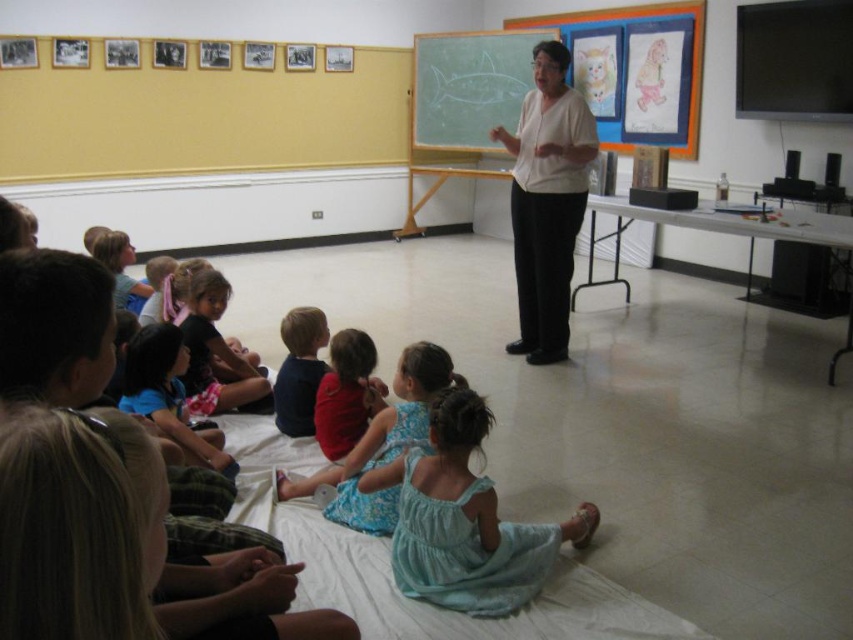
Question: Among these points, which one is nearest to the camera?

Choices:
 (A) (438, 472)
 (B) (212, 344)
 (C) (546, 332)
 (D) (432, 369)

Answer: (A)

Question: Which object is closer to the camera taking this photo?

Choices:
 (A) light blue dress at lower left
 (B) dark blue shirt at center

Answer: (A)

Question: Among these objects, which one is nearest to the camera?

Choices:
 (A) light pink fabric dress at lower left
 (B) dark blue shirt at center

Answer: (B)

Question: Where is light blue fabric dress at lower center located in relation to light pink fabric dress at lower left in the image?

Choices:
 (A) right
 (B) left

Answer: (A)

Question: Is light blue fabric dress at lower center bigger than dark blue shirt at center?

Choices:
 (A) no
 (B) yes

Answer: (B)

Question: From the image, what is the correct spatial relationship of light blue floral dress at lower center in relation to light blue dress at lower left?

Choices:
 (A) above
 (B) below

Answer: (B)